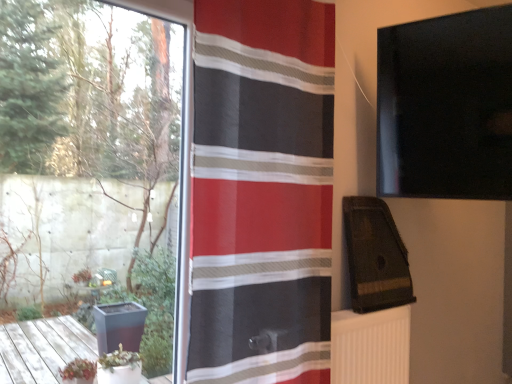
Image resolution: width=512 pixels, height=384 pixels. In order to click on vacant area on top of white ribbed radiator at lower right (from a real-world perspective) in this screenshot , I will do `click(366, 313)`.